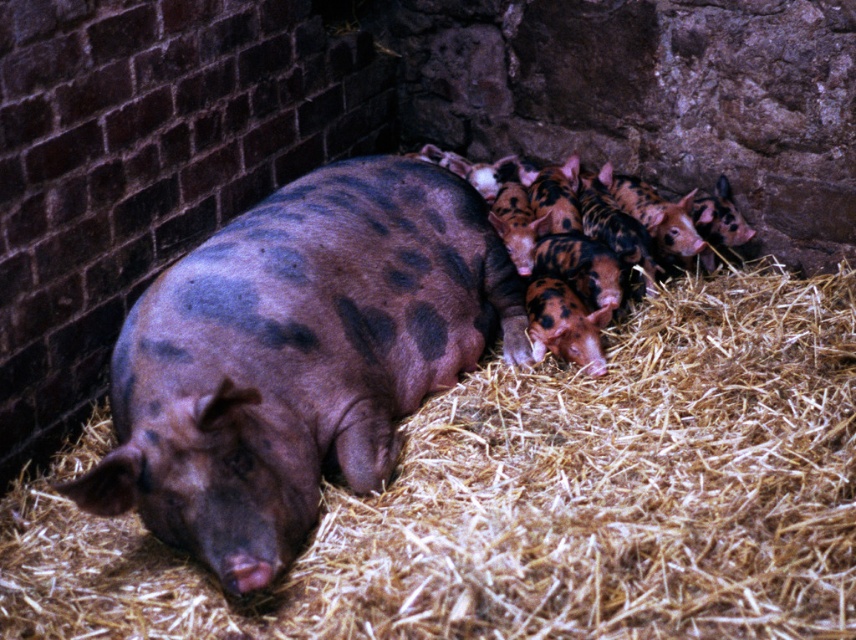
Question: Is brown straw at center in front of speckled brown pig at center?

Choices:
 (A) no
 (B) yes

Answer: (B)

Question: Among these objects, which one is farthest from the camera?

Choices:
 (A) speckled brown pig at center
 (B) brown straw at center

Answer: (A)

Question: Is brown straw at center behind speckled brown pig at center?

Choices:
 (A) yes
 (B) no

Answer: (B)

Question: Is brown straw at center thinner than speckled brown pig at center?

Choices:
 (A) yes
 (B) no

Answer: (B)

Question: Which of the following is the farthest from the observer?

Choices:
 (A) click(199, 432)
 (B) click(146, 632)

Answer: (A)

Question: Which point is farther to the camera?

Choices:
 (A) speckled brown pig at center
 (B) brown straw at center

Answer: (A)